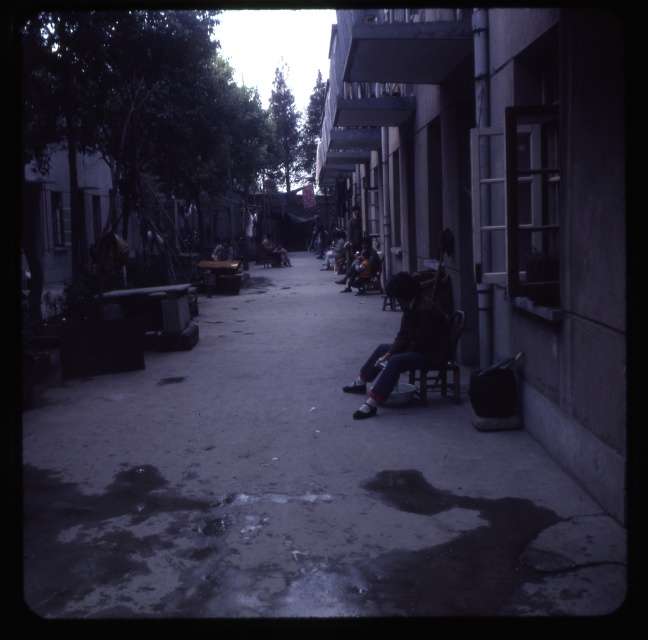
Question: Can you confirm if smooth concrete pavement at center is wider than dark brown leather jacket at center?

Choices:
 (A) yes
 (B) no

Answer: (A)

Question: Can you confirm if smooth concrete pavement at center is smaller than dark brown leather jacket at center?

Choices:
 (A) no
 (B) yes

Answer: (A)

Question: Which object appears closest to the camera in this image?

Choices:
 (A) dark brown leather jacket at center
 (B) smooth concrete pavement at center

Answer: (B)

Question: Which object appears closest to the camera in this image?

Choices:
 (A) dark brown leather jacket at center
 (B) smooth concrete pavement at center

Answer: (B)

Question: From the image, what is the correct spatial relationship of smooth concrete pavement at center in relation to dark brown leather jacket at center?

Choices:
 (A) left
 (B) right

Answer: (A)

Question: Which of the following is the farthest from the observer?

Choices:
 (A) (329, 452)
 (B) (443, 339)

Answer: (B)